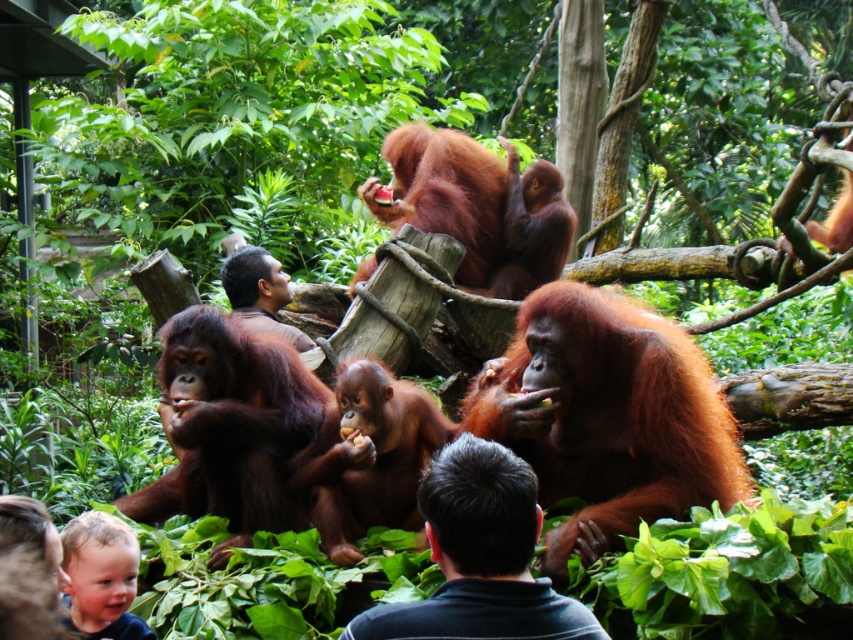
Question: Does dark blue shirt at center have a lesser width compared to blonde hair at lower left?

Choices:
 (A) no
 (B) yes

Answer: (A)

Question: Which point is closer to the camera taking this photo?

Choices:
 (A) (556, 422)
 (B) (451, 580)
 (C) (126, 547)

Answer: (B)

Question: Is shiny brown fur at center above dark blue shirt at center?

Choices:
 (A) no
 (B) yes

Answer: (B)

Question: Estimate the real-world distances between objects in this image. Which object is farther from the blonde hair at lower left?

Choices:
 (A) shiny brown fur at center
 (B) dark blue shirt at center

Answer: (A)

Question: Which point is closer to the camera?

Choices:
 (A) coord(102,548)
 (B) coord(631,316)
 (C) coord(479,634)

Answer: (C)

Question: Observing the image, what is the correct spatial positioning of dark blue shirt at center in reference to blonde hair at lower left?

Choices:
 (A) right
 (B) left

Answer: (A)